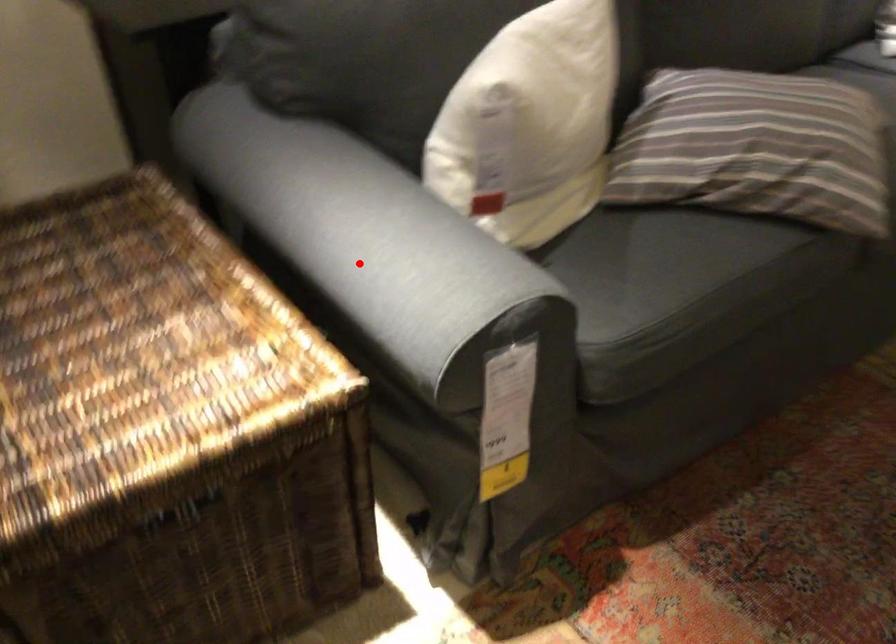
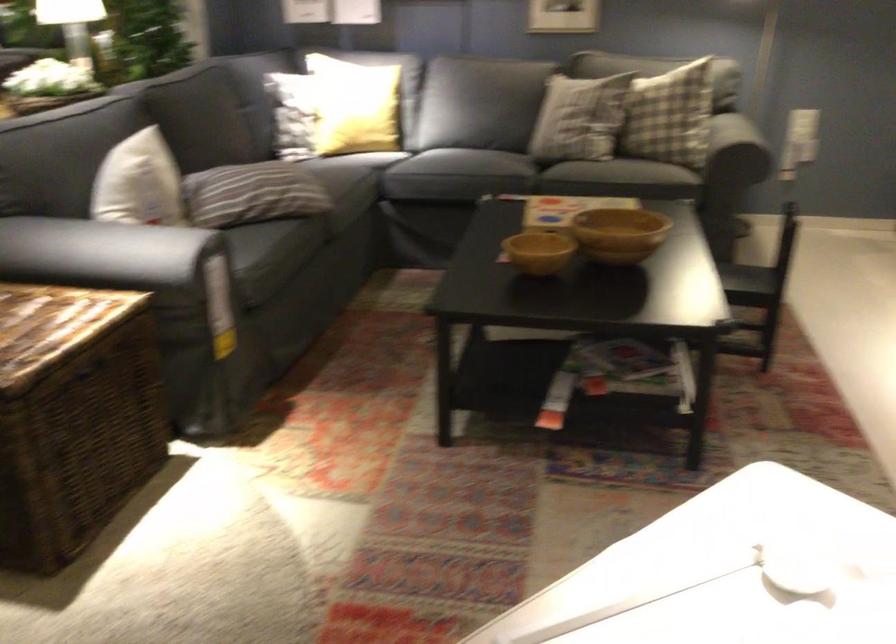
The point at the highlighted location is marked in the first image. Where is the corresponding point in the second image?

(117, 252)